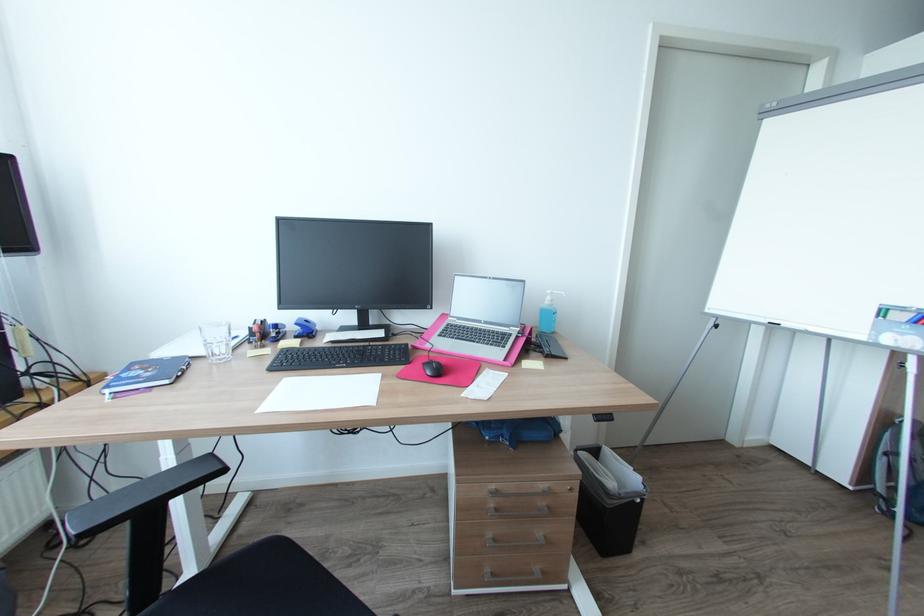
The width and height of the screenshot is (924, 616). Identify the location of black chair armrest. (143, 496).